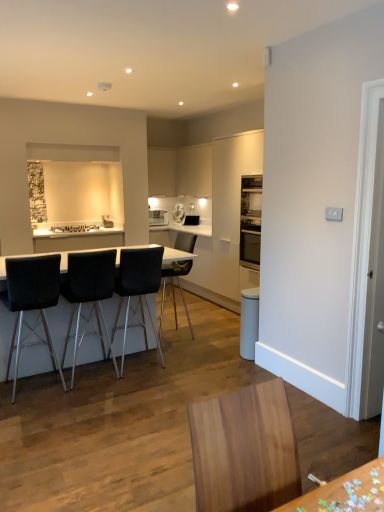
This screenshot has height=512, width=384. Identify the location of vacant space in front of white glossy table at center. (101, 428).